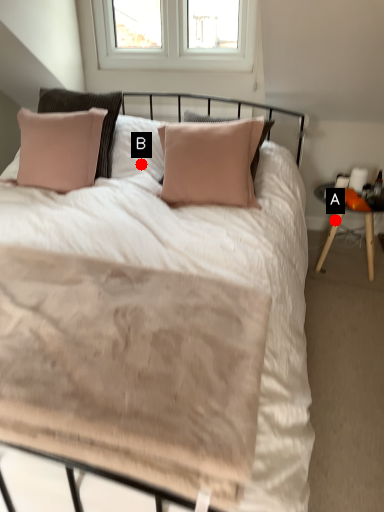
Question: Two points are circled on the image, labeled by A and B beside each circle. Which point is closer to the camera?

Choices:
 (A) A is closer
 (B) B is closer

Answer: (B)